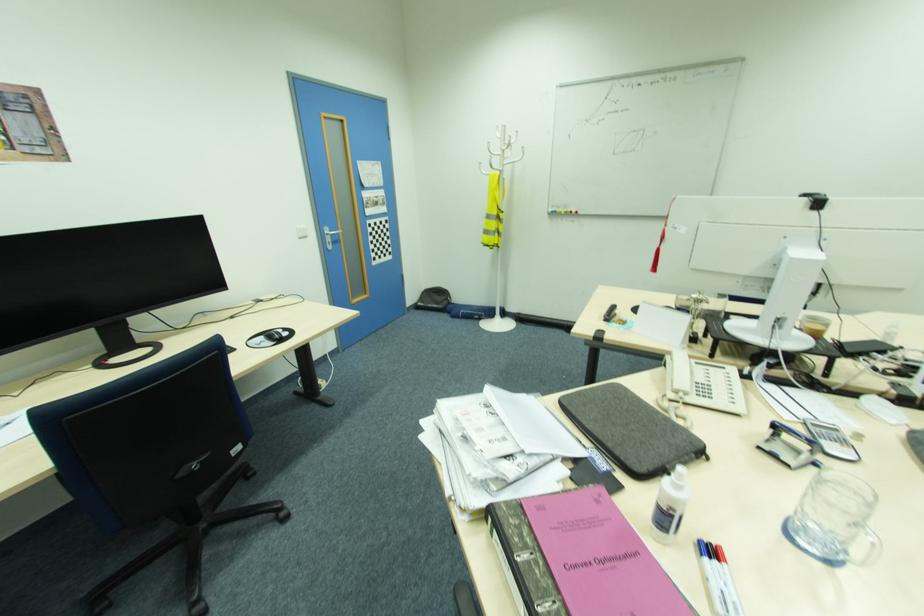
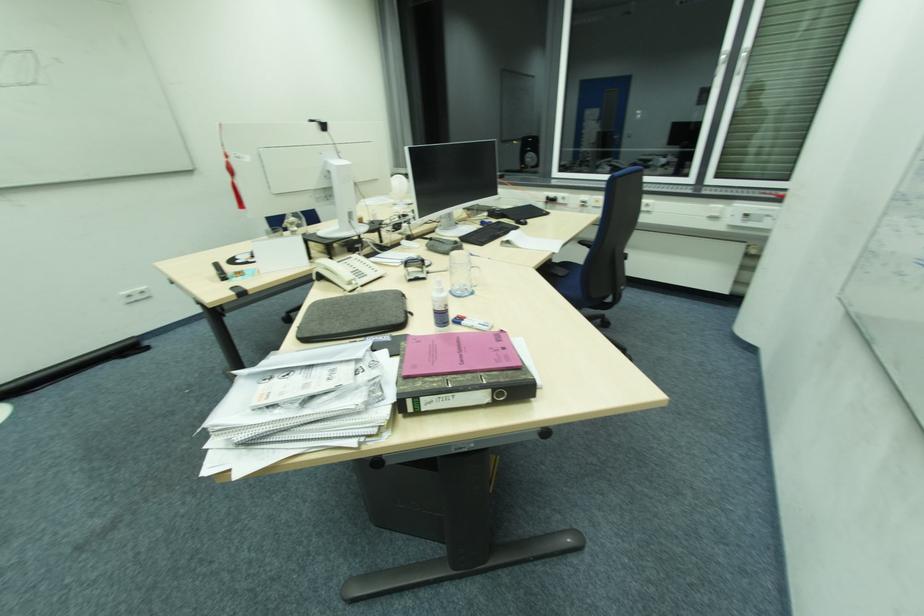
Where in the second image is the point corresponding to (590,426) from the first image?

(348, 331)